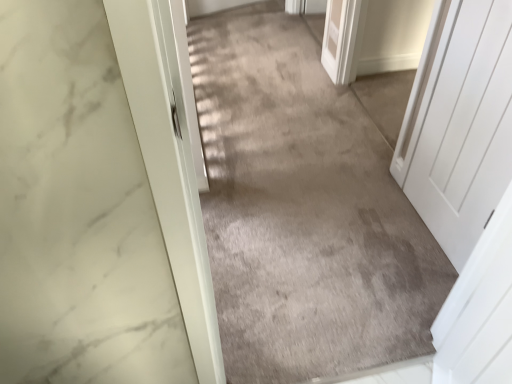
Question: Is white matte door at right situated inside gray carpet at center or outside?

Choices:
 (A) inside
 (B) outside

Answer: (B)

Question: From the image's perspective, relative to gray carpet at center, is white matte door at right above or below?

Choices:
 (A) above
 (B) below

Answer: (B)

Question: Considering the positions of point (442, 155) and point (307, 273), is point (442, 155) closer or farther from the camera than point (307, 273)?

Choices:
 (A) farther
 (B) closer

Answer: (B)

Question: Considering the positions of gray carpet at center and white matte door at right in the image, is gray carpet at center wider or thinner than white matte door at right?

Choices:
 (A) thin
 (B) wide

Answer: (B)

Question: Considering the positions of gray carpet at center and white matte door at right in the image, is gray carpet at center bigger or smaller than white matte door at right?

Choices:
 (A) small
 (B) big

Answer: (B)

Question: Considering their positions, is gray carpet at center located in front of or behind white matte door at right?

Choices:
 (A) front
 (B) behind

Answer: (B)

Question: Do you think gray carpet at center is within white matte door at right, or outside of it?

Choices:
 (A) outside
 (B) inside

Answer: (A)